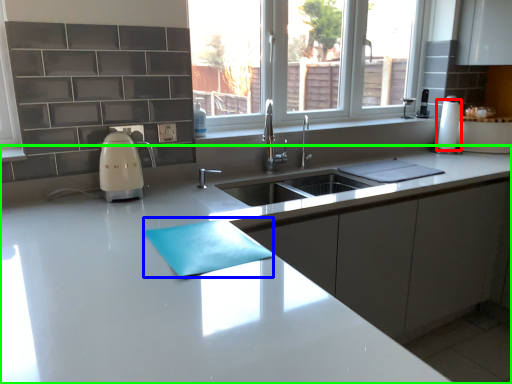
Question: Estimate the real-world distances between objects in this image. Which object is closer to paper towel (highlighted by a red box), place mat (highlighted by a blue box) or countertop (highlighted by a green box)?

Choices:
 (A) place mat
 (B) countertop

Answer: (B)